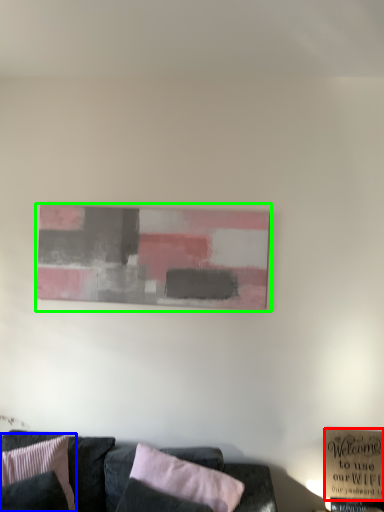
Question: Estimate the real-world distances between objects in this image. Which object is closer to plaque (highlighted by a red box), pillow (highlighted by a blue box) or picture frame (highlighted by a green box)?

Choices:
 (A) pillow
 (B) picture frame

Answer: (B)